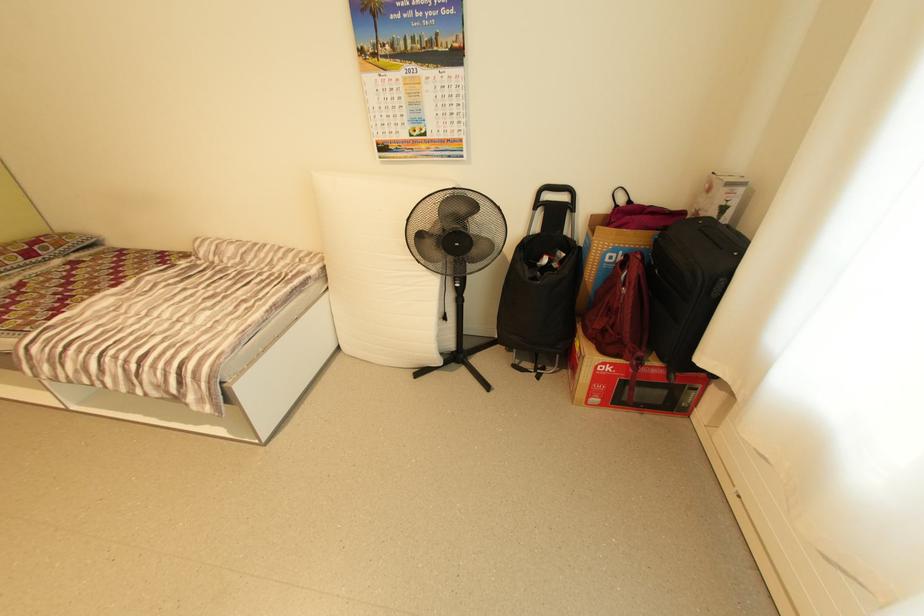
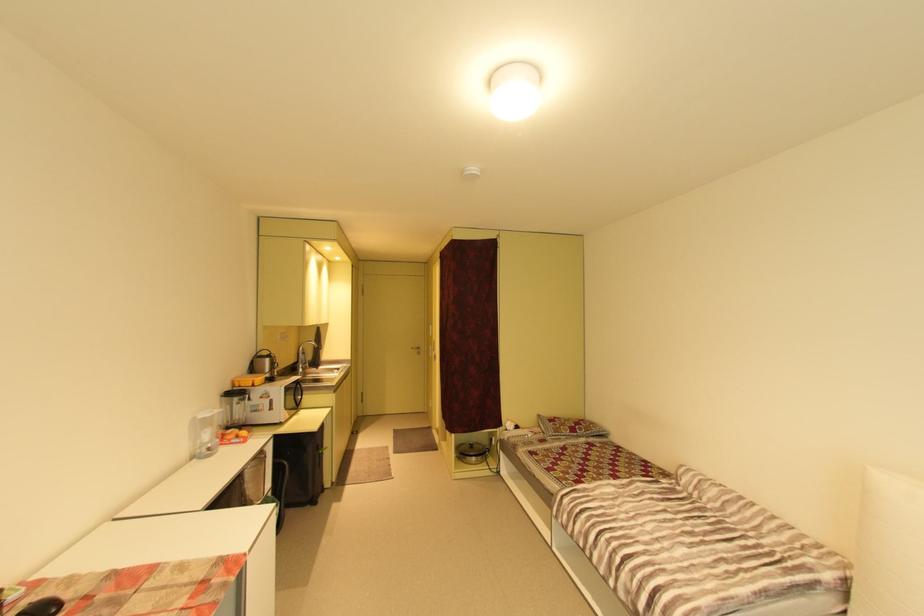
Question: How did the camera likely rotate?

Choices:
 (A) Left
 (B) Right
 (C) Up
 (D) Down

Answer: (A)